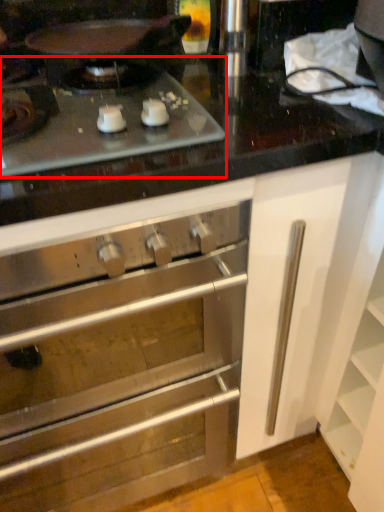
Question: Observing the image, what is the correct spatial positioning of gas stove (annotated by the red box) in reference to cabinetry?

Choices:
 (A) left
 (B) right

Answer: (B)